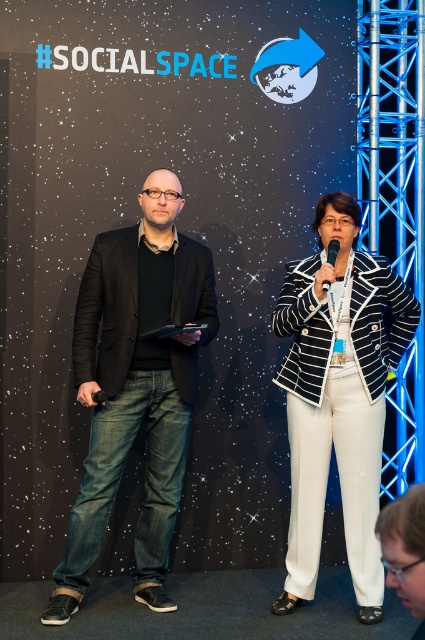
Question: Estimate the real-world distances between objects in this image. Which object is farther from the black matte microphone at center?

Choices:
 (A) black matte blazer at left
 (B) black plastic microphone at center
 (C) black and white striped blazer at center

Answer: (B)

Question: Does black and white striped blazer at center appear over black matte microphone at center?

Choices:
 (A) no
 (B) yes

Answer: (A)

Question: Which point is farther to the camera?

Choices:
 (A) tap(326, 259)
 (B) tap(61, 564)
 (C) tap(104, 396)
 (D) tap(356, 509)

Answer: (B)

Question: Is black and white striped blazer at center thinner than black plastic microphone at center?

Choices:
 (A) yes
 (B) no

Answer: (B)

Question: Does black matte blazer at left appear under black plastic microphone at center?

Choices:
 (A) no
 (B) yes

Answer: (B)

Question: Which of the following is the closest to the observer?

Choices:
 (A) black and white striped blazer at center
 (B) black plastic microphone at center
 (C) black matte blazer at left

Answer: (C)